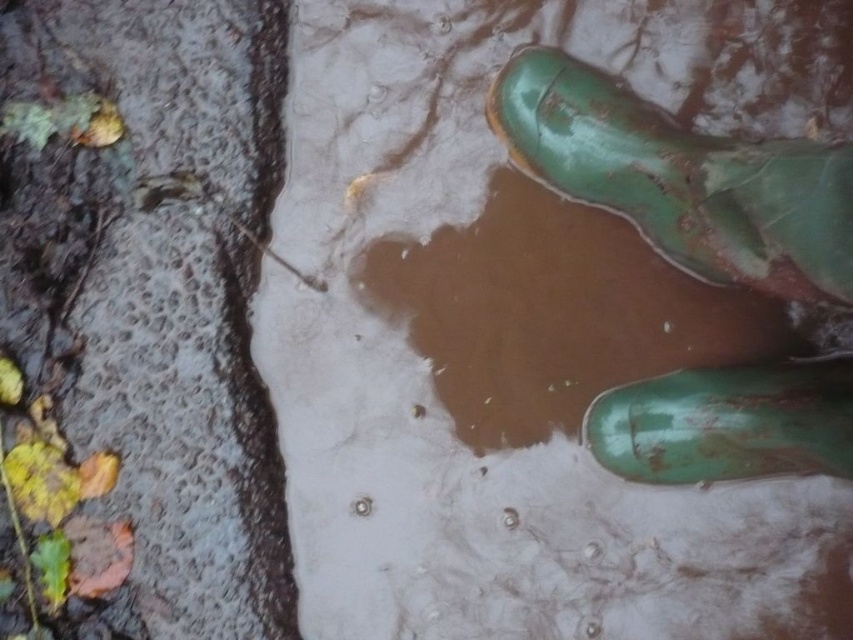
Can you confirm if brown matte mud at lower left is positioned to the right of green rubber boot at upper right?

In fact, brown matte mud at lower left is to the left of green rubber boot at upper right.

Is brown matte mud at lower left taller than green rubber boot at upper right?

Yes, brown matte mud at lower left is taller than green rubber boot at upper right.

Which is in front, point (96, 570) or point (537, 68)?

Point (96, 570)

What are the coordinates of `brown matte mud at lower left` in the screenshot? It's located at (152, 301).

Can you confirm if muddy rubber boots at upper right is wider than green rubber boot at lower right?

Yes, muddy rubber boots at upper right is wider than green rubber boot at lower right.

Is point (438, 480) closer to camera compared to point (712, 426)?

No, it is not.

This screenshot has height=640, width=853. Find the location of `muddy rubber boots at upper right`. muddy rubber boots at upper right is located at coordinates (463, 380).

Can you confirm if green rubber boot at upper right is taller than green rubber boot at lower right?

Yes.

Does green rubber boot at upper right have a greater width compared to green rubber boot at lower right?

Yes.

Does point (556, 182) come behind point (693, 385)?

Yes, it is behind point (693, 385).

Identify the location of green rubber boot at upper right. The width and height of the screenshot is (853, 640). (682, 179).